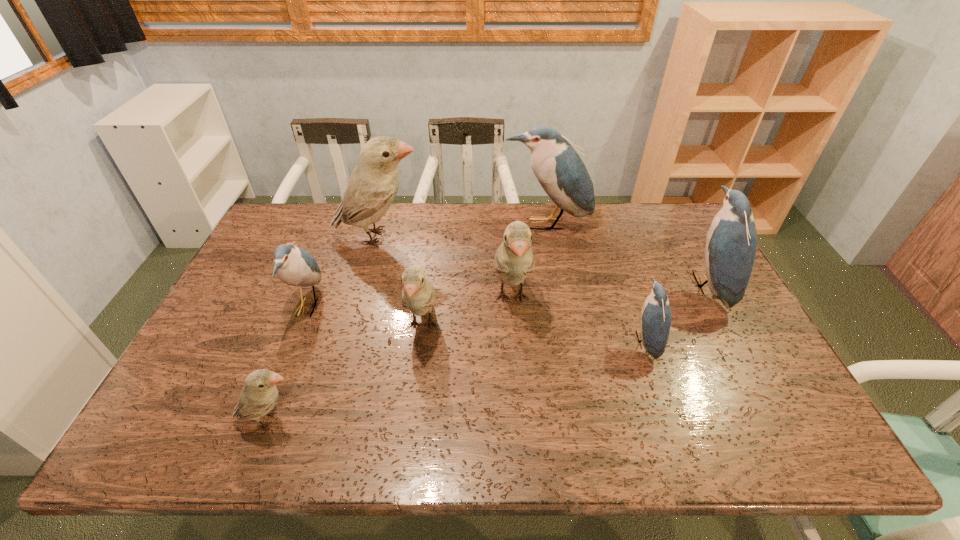
Where is `blank area located at the tip of the second bird from right to left's beak`? This screenshot has width=960, height=540. blank area located at the tip of the second bird from right to left's beak is located at coordinates coord(557,341).

Image resolution: width=960 pixels, height=540 pixels. Identify the location of vacant space situated at the tip of the second bird from right to left's beak. (516, 341).

You are a GUI agent. You are given a task and a screenshot of the screen. Output one action in this format:
    pyautogui.click(x=<x>, y=<y>)
    Task: Click on the vacant area situated at the tip of the second bird from right to left's beak
    The image size is (960, 540).
    Given the screenshot: What is the action you would take?
    pyautogui.click(x=486, y=341)

What are the coordinates of `vacant space situated at the face of the nearest bird` in the screenshot? It's located at (335, 420).

Locate an element on the screen. The image size is (960, 540). object that is at the near edge is located at coordinates (259, 395).

Locate an element on the screen. This screenshot has width=960, height=540. object that is at the right edge is located at coordinates (731, 243).

Image resolution: width=960 pixels, height=540 pixels. What are the coordinates of `vacant region at the far edge` in the screenshot? It's located at (477, 219).

This screenshot has height=540, width=960. In the image, there is a desktop. Identify the location of vacant space at the near edge. point(449,425).

Where is `vacant region at the left edge of the desktop`? Image resolution: width=960 pixels, height=540 pixels. vacant region at the left edge of the desktop is located at coordinates (244, 372).

Identify the location of free space at the right edge of the desktop. (700, 263).